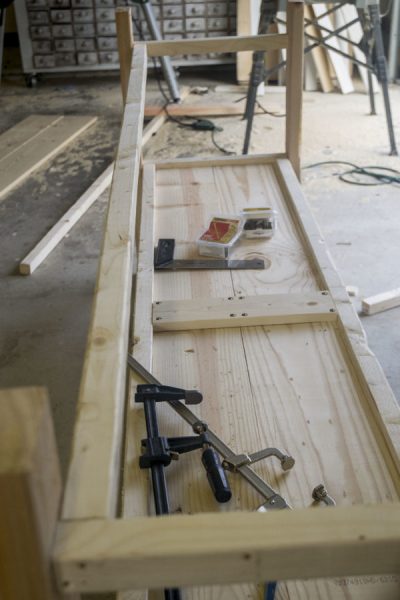
At what (x,y) coordinates should I click in order to perform the action: click on empty space on the floor. Please return your answer as a coordinate pair (x, y). Looking at the image, I should click on (32, 322), (371, 229).